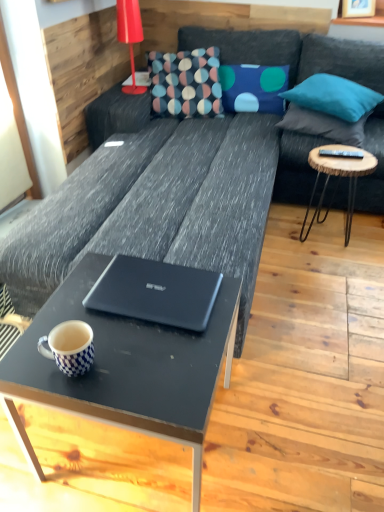
The height and width of the screenshot is (512, 384). In order to click on vacant area that is in front of matte black laptop at center in this screenshot , I will do `click(148, 362)`.